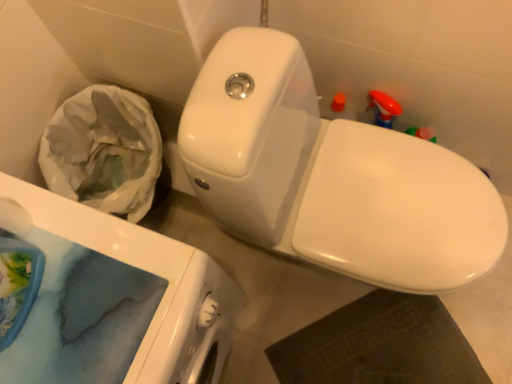
Question: Is white matte toilet paper at lower left positioned far away from white glossy porcelain at upper right?

Choices:
 (A) no
 (B) yes

Answer: (A)

Question: From a real-world perspective, is white matte toilet paper at lower left positioned over white glossy porcelain at upper right based on gravity?

Choices:
 (A) no
 (B) yes

Answer: (B)

Question: Does white matte toilet paper at lower left have a lesser width compared to white glossy porcelain at upper right?

Choices:
 (A) no
 (B) yes

Answer: (B)

Question: Can you confirm if white matte toilet paper at lower left is wider than white glossy porcelain at upper right?

Choices:
 (A) no
 (B) yes

Answer: (A)

Question: Does white matte toilet paper at lower left have a larger size compared to white glossy porcelain at upper right?

Choices:
 (A) yes
 (B) no

Answer: (B)

Question: Is white glossy toilet at center taller or shorter than white matte toilet paper at lower left?

Choices:
 (A) short
 (B) tall

Answer: (B)

Question: Is white glossy toilet at center wider or thinner than white matte toilet paper at lower left?

Choices:
 (A) thin
 (B) wide

Answer: (B)

Question: Considering the positions of white glossy toilet at center and white matte toilet paper at lower left in the image, is white glossy toilet at center bigger or smaller than white matte toilet paper at lower left?

Choices:
 (A) small
 (B) big

Answer: (B)

Question: From a real-world perspective, is white glossy toilet at center physically located above or below white matte toilet paper at lower left?

Choices:
 (A) below
 (B) above

Answer: (A)

Question: Considering the positions of white glossy toilet at center and white glossy porcelain at upper right in the image, is white glossy toilet at center bigger or smaller than white glossy porcelain at upper right?

Choices:
 (A) small
 (B) big

Answer: (A)

Question: Is point (221, 36) positioned closer to the camera than point (232, 302)?

Choices:
 (A) closer
 (B) farther

Answer: (A)

Question: From the image's perspective, is white glossy toilet at center positioned above or below white glossy porcelain at upper right?

Choices:
 (A) above
 (B) below

Answer: (A)

Question: Would you say white glossy toilet at center is to the left or to the right of white glossy porcelain at upper right in the picture?

Choices:
 (A) left
 (B) right

Answer: (B)

Question: From a real-world perspective, relative to white glossy toilet at center, is white glossy porcelain at upper right vertically above or below?

Choices:
 (A) below
 (B) above

Answer: (A)

Question: Does point (142, 301) appear closer or farther from the camera than point (372, 253)?

Choices:
 (A) closer
 (B) farther

Answer: (A)